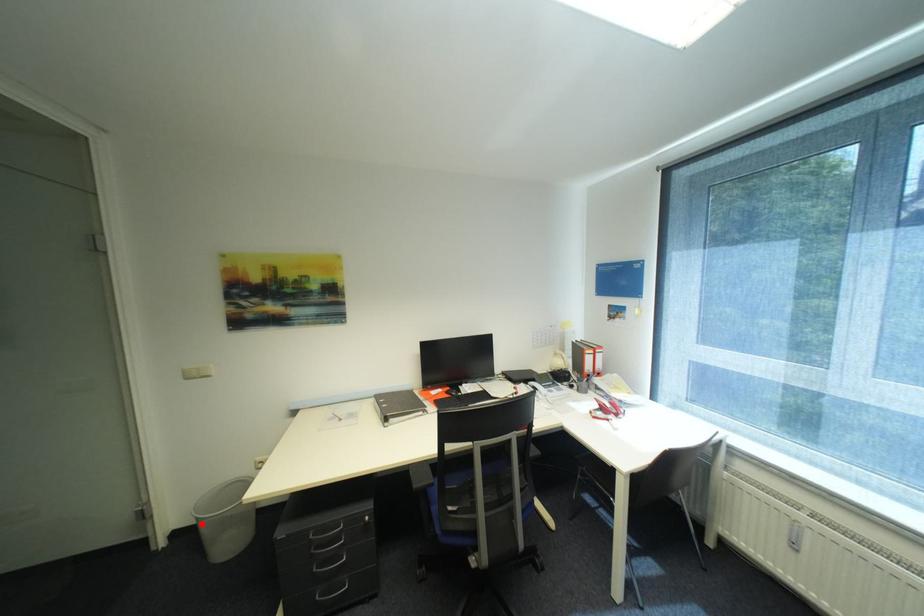
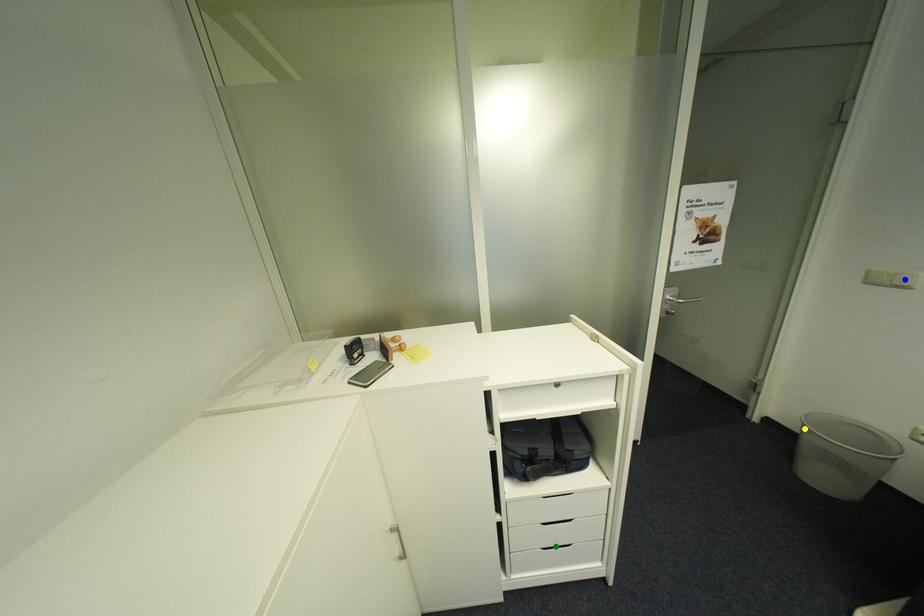
Question: I am providing you with two images of the same scene from different viewpoints. A red point is marked on the first image. You are given multiple points on the second image. Which spot in image 2 lines up with the point in image 1?

Choices:
 (A) green point
 (B) yellow point
 (C) blue point

Answer: (B)